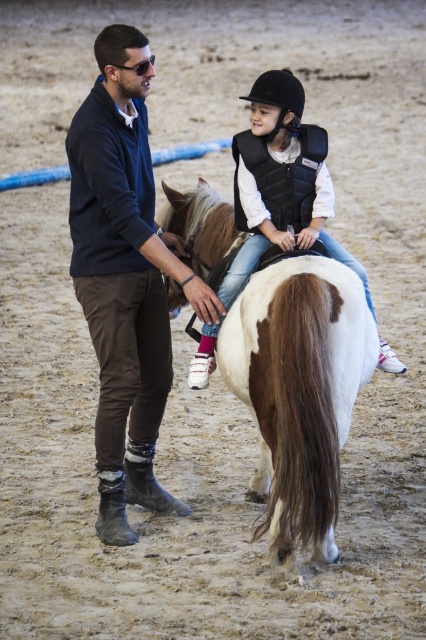
Question: Which point is farther from the camera taking this photo?

Choices:
 (A) (201, 192)
 (B) (86, 170)

Answer: (A)

Question: Observing the image, what is the correct spatial positioning of white glossy horse at center in reference to white matte vest at center?

Choices:
 (A) above
 (B) below

Answer: (B)

Question: Is dark blue sweater at center smaller than white matte vest at center?

Choices:
 (A) no
 (B) yes

Answer: (A)

Question: Which of the following is the farthest from the observer?

Choices:
 (A) dark blue sweater at center
 (B) white glossy horse at center

Answer: (A)

Question: Is dark blue sweater at center behind white glossy horse at center?

Choices:
 (A) yes
 (B) no

Answer: (A)

Question: Estimate the real-world distances between objects in this image. Which object is closer to the white matte vest at center?

Choices:
 (A) white glossy horse at center
 (B) dark blue sweater at center

Answer: (B)